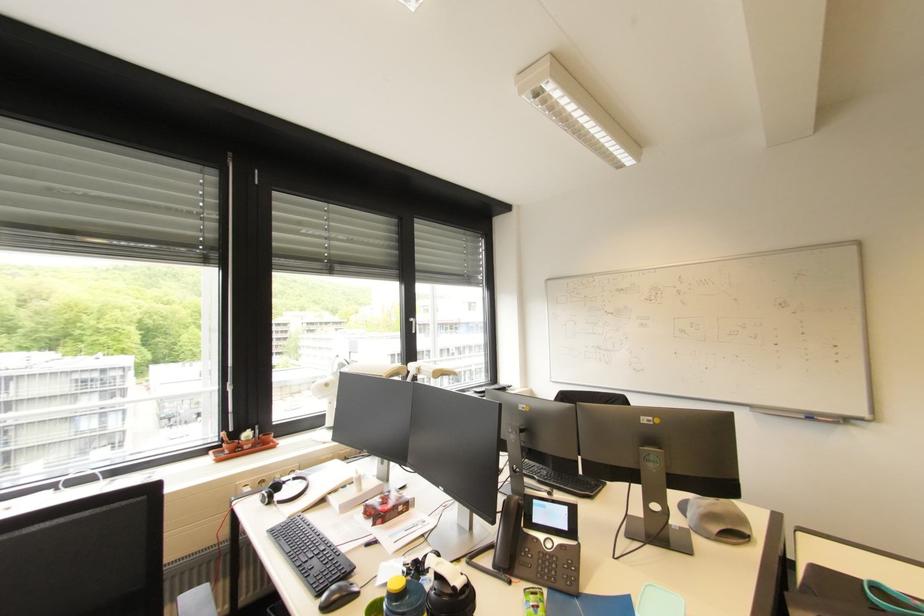
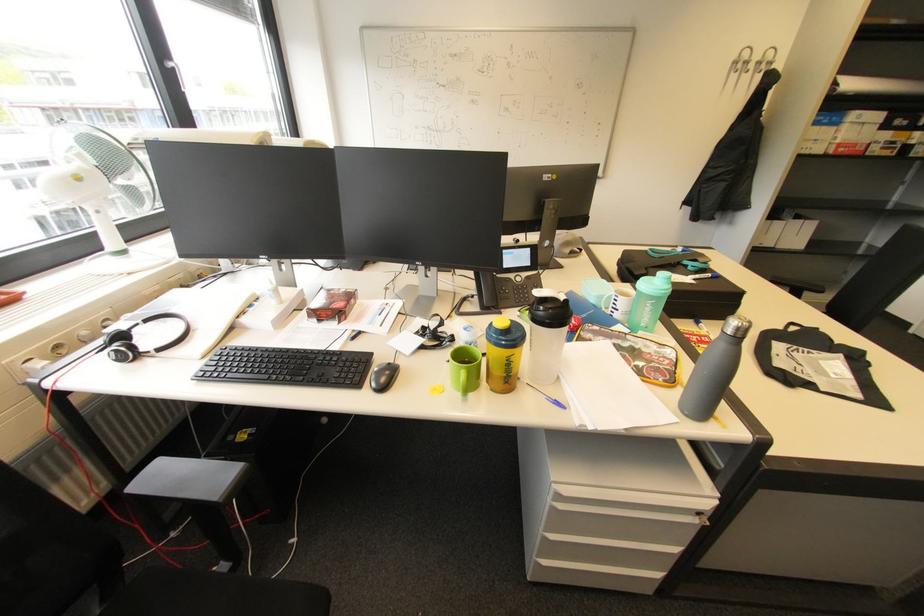
In the second image, find the point that corresponds to point 508,570 in the first image.

(496, 308)